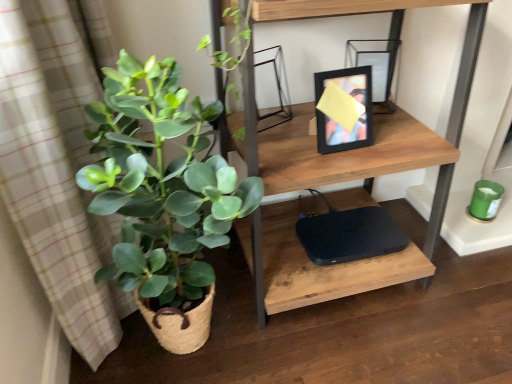
Image resolution: width=512 pixels, height=384 pixels. I want to click on free region under green woven basket at left (from a real-world perspective), so click(193, 351).